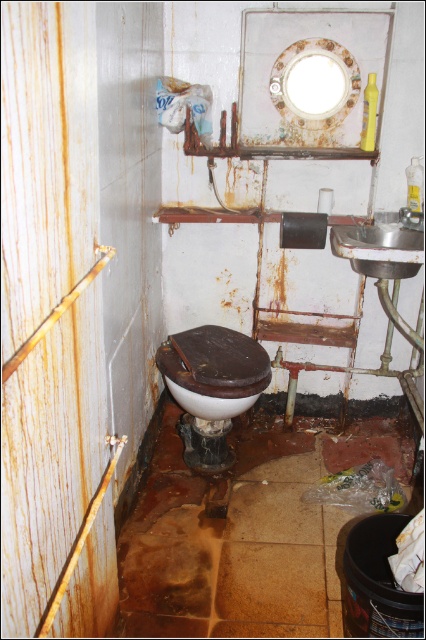
Question: Can you confirm if white glossy toilet bowl at center is positioned to the right of satin silver sink at right?

Choices:
 (A) no
 (B) yes

Answer: (A)

Question: Is white glossy toilet bowl at center further to camera compared to satin silver sink at right?

Choices:
 (A) no
 (B) yes

Answer: (B)

Question: Does white glossy toilet bowl at center have a larger size compared to satin silver sink at right?

Choices:
 (A) yes
 (B) no

Answer: (A)